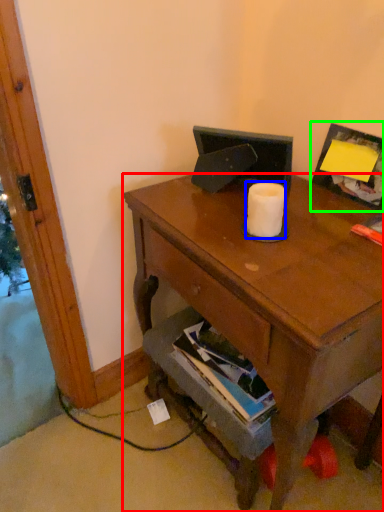
Question: Considering the real-world distances, which object is closest to desk (highlighted by a red box)? toilet paper (highlighted by a blue box) or picture frame (highlighted by a green box).

Choices:
 (A) toilet paper
 (B) picture frame

Answer: (A)